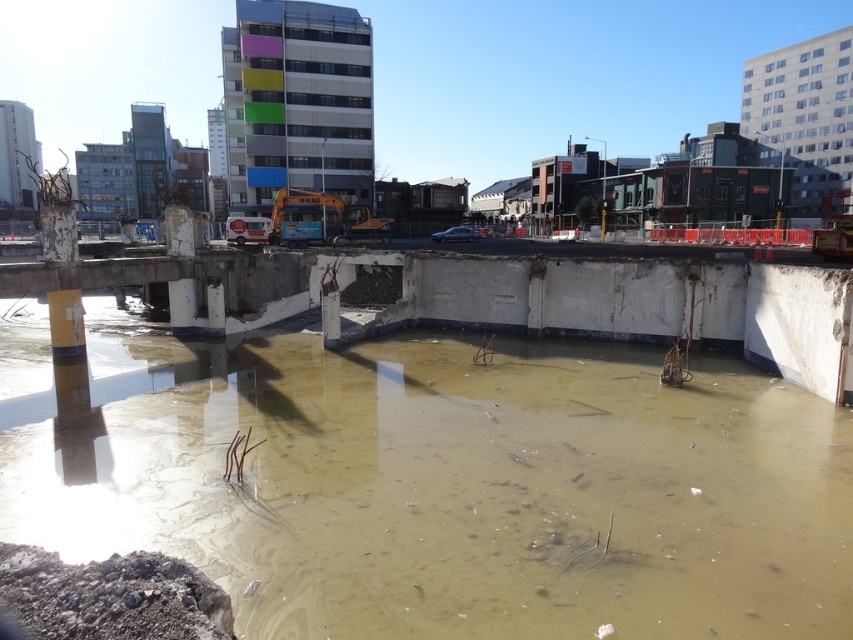
Question: Is muddy concrete water at center positioned behind concrete bridge at center?

Choices:
 (A) no
 (B) yes

Answer: (A)

Question: Which object appears closest to the camera in this image?

Choices:
 (A) concrete bridge at center
 (B) muddy concrete water at center

Answer: (B)

Question: Is muddy concrete water at center above concrete bridge at center?

Choices:
 (A) no
 (B) yes

Answer: (A)

Question: Does muddy concrete water at center have a lesser width compared to concrete bridge at center?

Choices:
 (A) yes
 (B) no

Answer: (B)

Question: Among these points, which one is nearest to the camera?

Choices:
 (A) (35, 321)
 (B) (158, 260)

Answer: (B)